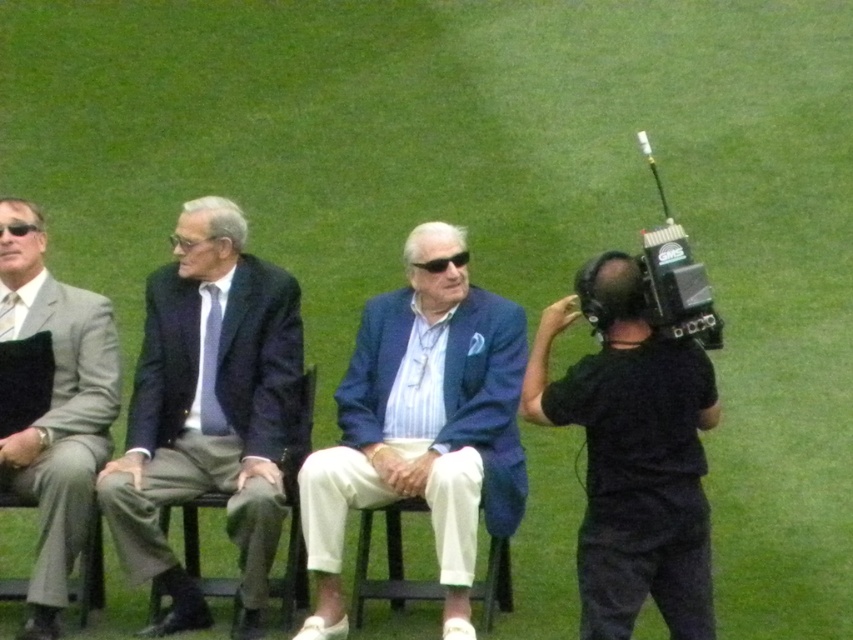
Which is in front, point (370, 401) or point (201, 500)?

Point (201, 500)

Who is lower down, blue fabric jacket at center or dark gray fabric chair at center?

dark gray fabric chair at center is below.

Where is `blue fabric jacket at center`? The height and width of the screenshot is (640, 853). blue fabric jacket at center is located at coordinates (422, 426).

Which is behind, point (416, 378) or point (624, 484)?

The point (416, 378) is more distant.

Consider the image. Can you confirm if blue fabric jacket at center is positioned to the left of black matte camera at right?

Correct, you'll find blue fabric jacket at center to the left of black matte camera at right.

At what (x,y) coordinates should I click in order to perform the action: click on blue fabric jacket at center. Please return your answer as a coordinate pair (x, y). Looking at the image, I should click on (422, 426).

Is blue fabric jacket at center bigger than black plastic video camera at right?

Yes, blue fabric jacket at center is bigger than black plastic video camera at right.

The width and height of the screenshot is (853, 640). What do you see at coordinates (422, 426) in the screenshot?
I see `blue fabric jacket at center` at bounding box center [422, 426].

Image resolution: width=853 pixels, height=640 pixels. I want to click on blue fabric jacket at center, so click(422, 426).